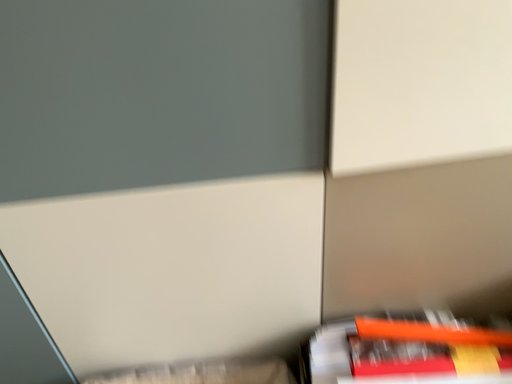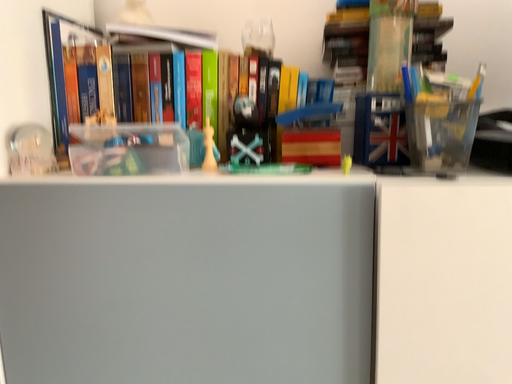
Question: How did the camera likely rotate when shooting the video?

Choices:
 (A) rotated downward
 (B) rotated upward

Answer: (B)